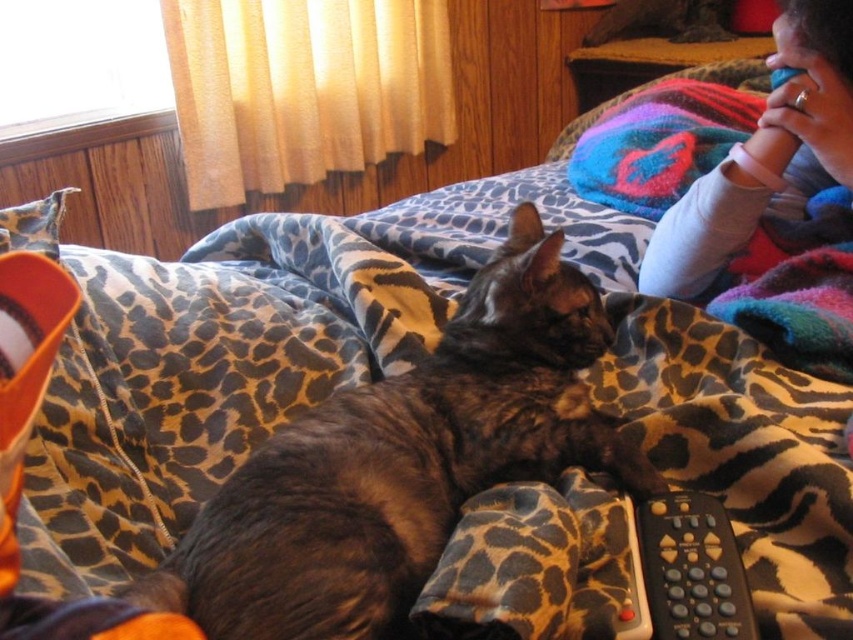
Question: Which of the following is the closest to the observer?

Choices:
 (A) (726, 216)
 (B) (666, 536)
 (C) (424, 520)

Answer: (B)

Question: Which object is the farthest from the brown fur cat at center?

Choices:
 (A) black plastic remote at lower right
 (B) smooth pink baby rattle at upper right

Answer: (B)

Question: Is smooth pink baby rattle at upper right smaller than black plastic remote at lower right?

Choices:
 (A) no
 (B) yes

Answer: (A)

Question: In this image, where is smooth pink baby rattle at upper right located relative to black plastic remote at lower right?

Choices:
 (A) right
 (B) left

Answer: (A)

Question: Which object is positioned closest to the smooth pink baby rattle at upper right?

Choices:
 (A) brown fur cat at center
 (B) black plastic remote at lower right

Answer: (A)

Question: Is brown fur cat at center above smooth pink baby rattle at upper right?

Choices:
 (A) yes
 (B) no

Answer: (B)